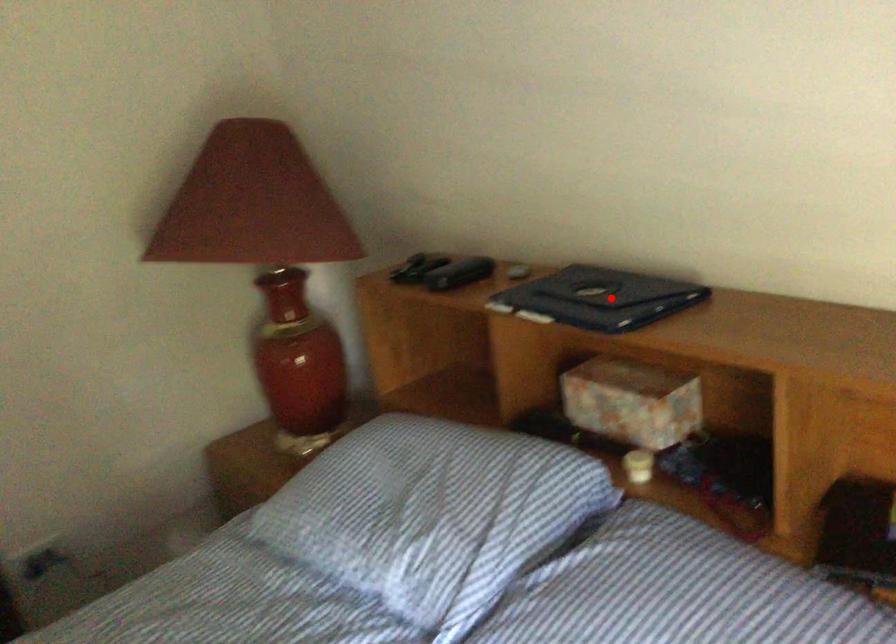
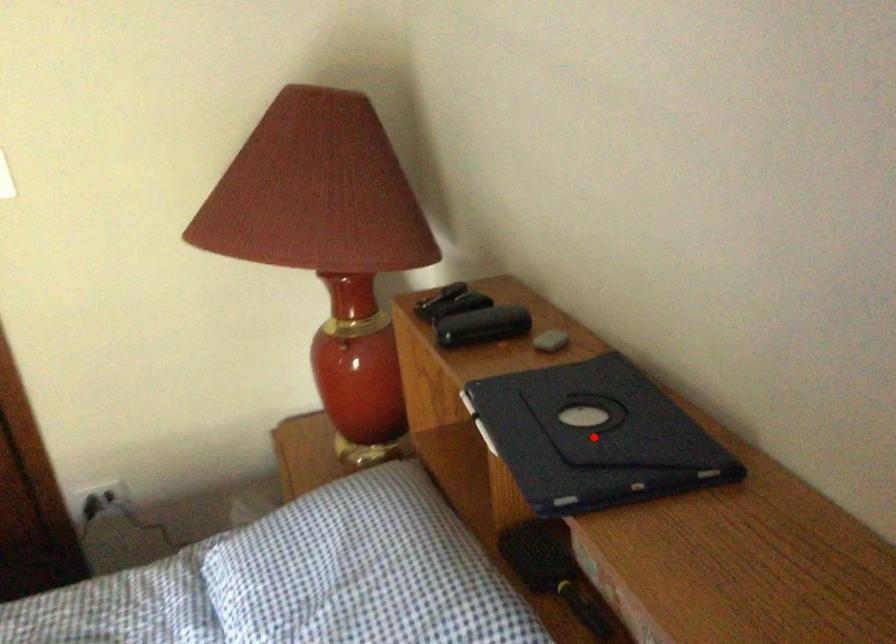
I am providing you with two images of the same scene from different viewpoints. A red point is marked on the first image and another point is marked on the second image. Is the red point in image1 aligned with the point shown in image2?

Yes